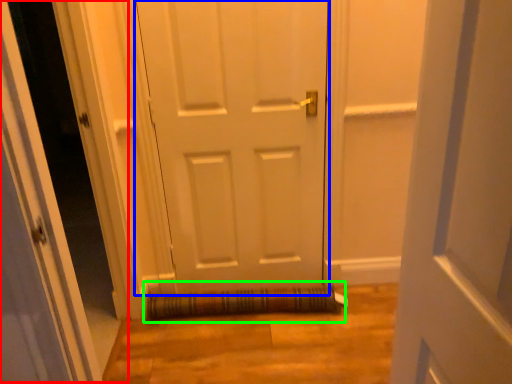
Question: Estimate the real-world distances between objects in this image. Which object is closer to glass door (highlighted by a red box), door (highlighted by a blue box) or doormat (highlighted by a green box)?

Choices:
 (A) door
 (B) doormat

Answer: (B)